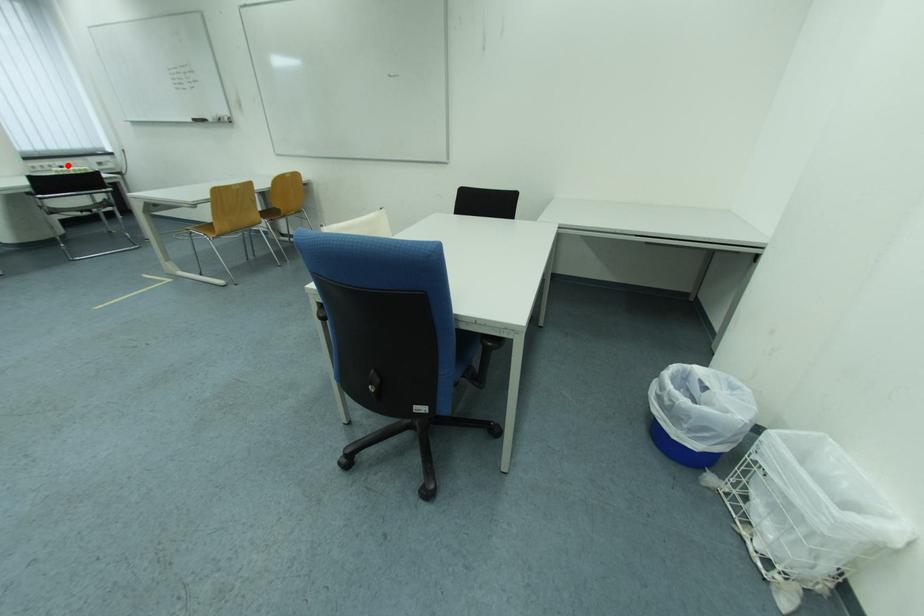
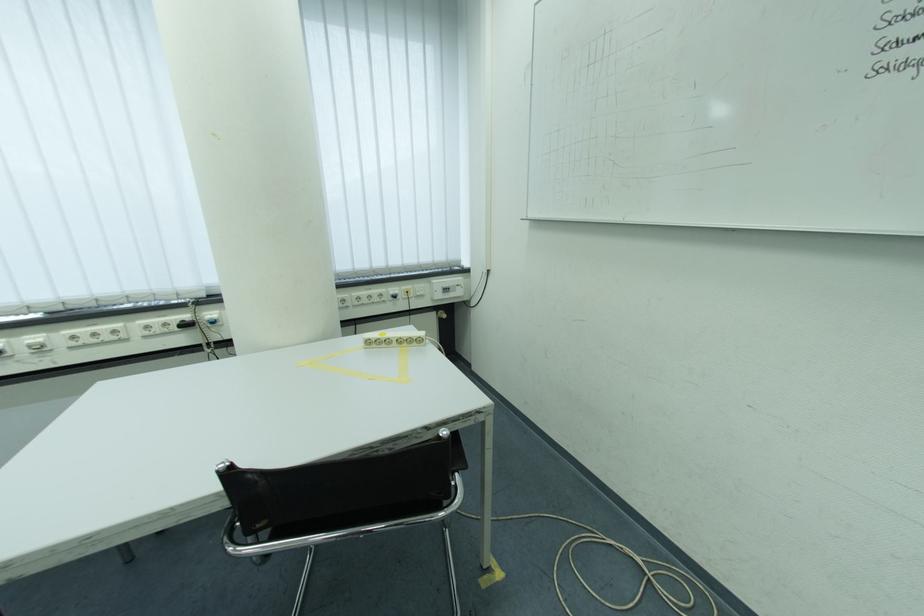
Question: I am providing you with two images of the same scene from different viewpoints. Image1 has a red point marked. In image2, the corresponding 3D location appears at what relative position? Reply with the corresponding letter.

Choices:
 (A) Closer
 (B) Farther

Answer: (A)